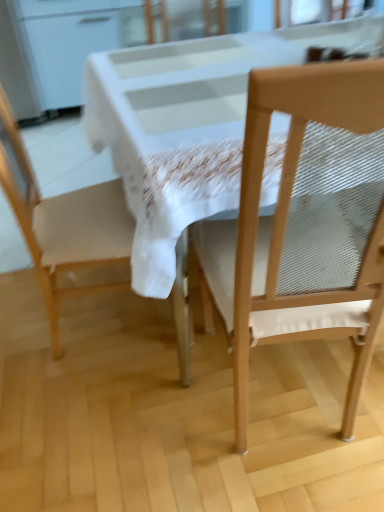
Image resolution: width=384 pixels, height=512 pixels. What are the coordinates of `vacant space underneath wooden chair at right, marked as the second chair in a left-to-right arrangement (from a real-world perspective)` in the screenshot? It's located at (293, 406).